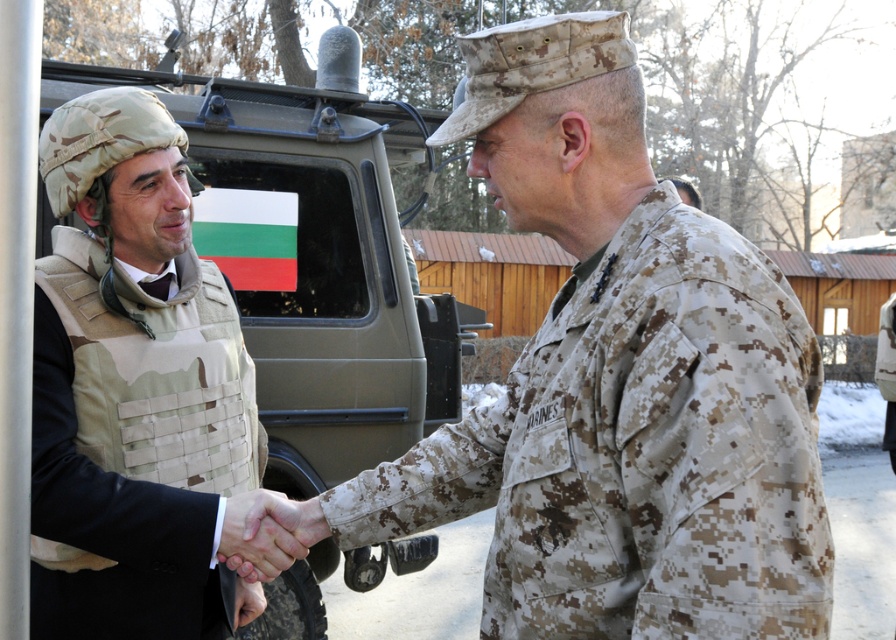
Question: Estimate the real-world distances between objects in this image. Which object is closer to the camouflage fabric vest at center?

Choices:
 (A) smooth skin handshake at center
 (B) camouflage fabric uniform at center

Answer: (A)

Question: Does camouflage fabric uniform at center appear on the right side of smooth skin handshake at center?

Choices:
 (A) yes
 (B) no

Answer: (A)

Question: Is camouflage fabric uniform at center thinner than camouflage fabric vest at center?

Choices:
 (A) yes
 (B) no

Answer: (B)

Question: Estimate the real-world distances between objects in this image. Which object is closer to the smooth skin handshake at center?

Choices:
 (A) camouflage fabric vest at center
 (B) camouflage fabric uniform at center

Answer: (A)

Question: Is camouflage fabric vest at center smaller than smooth skin handshake at center?

Choices:
 (A) no
 (B) yes

Answer: (A)

Question: Which object is closer to the camera taking this photo?

Choices:
 (A) smooth skin handshake at center
 (B) camouflage fabric vest at center
 (C) camouflage fabric uniform at center

Answer: (C)